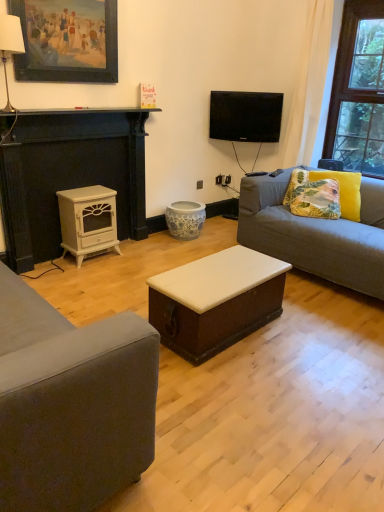
Identify the location of vacant space in front of white painted wood trunk at center, marked as the first table in a front-to-back arrangement. This screenshot has height=512, width=384. (251, 390).